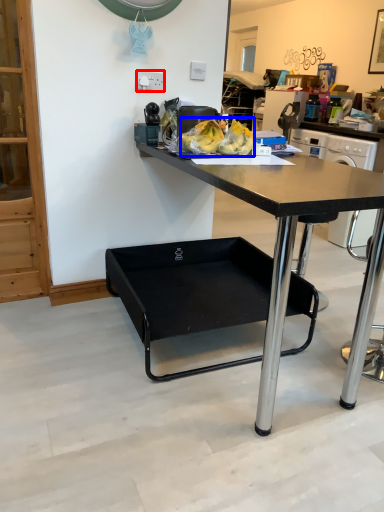
Question: Which object appears closest to the camera in this image, power outlet (highlighted by a red box) or food (highlighted by a blue box)?

Choices:
 (A) power outlet
 (B) food

Answer: (B)